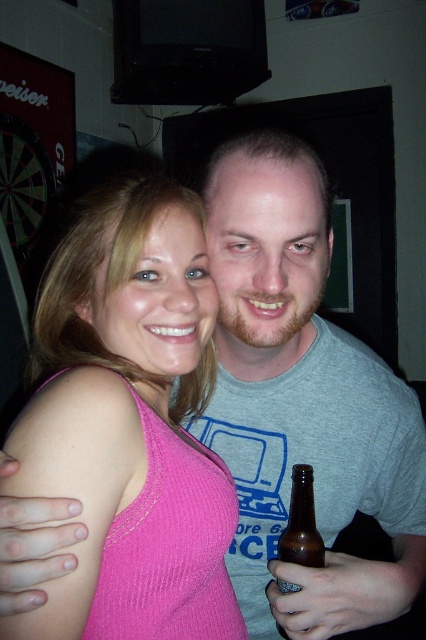
Does pink ribbed tank top at center have a lesser width compared to gray cotton t-shirt at center?

Yes.

Can you confirm if pink ribbed tank top at center is wider than gray cotton t-shirt at center?

In fact, pink ribbed tank top at center might be narrower than gray cotton t-shirt at center.

Who is more forward, (88, 292) or (313, 636)?

Point (313, 636) is more forward.

The width and height of the screenshot is (426, 640). Find the location of `pink ribbed tank top at center`. pink ribbed tank top at center is located at coordinates (129, 424).

Who is more distant from viewer, (253, 176) or (284, 548)?

The point (284, 548) is behind.

Where is `gray cotton t-shirt at center`? The width and height of the screenshot is (426, 640). gray cotton t-shirt at center is located at coordinates (302, 401).

Between point (42, 294) and point (296, 529), which one is positioned behind?

The point (42, 294) is behind.

Based on the photo, which is more to the right, pink ribbed tank top at center or brown glass bottle at lower right?

From the viewer's perspective, brown glass bottle at lower right appears more on the right side.

Is point (55, 416) more distant than point (305, 465)?

No, it is not.

This screenshot has width=426, height=640. In order to click on pink ribbed tank top at center in this screenshot , I will do `click(129, 424)`.